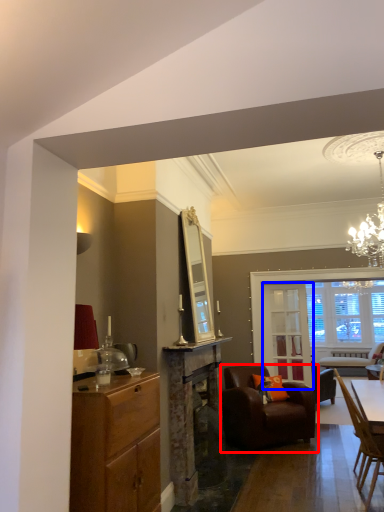
Question: Which object appears closest to the camera in this image, chair (highlighted by a red box) or glass door (highlighted by a blue box)?

Choices:
 (A) chair
 (B) glass door

Answer: (A)